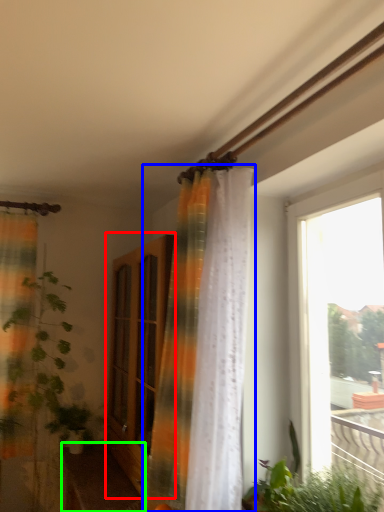
Question: Estimate the real-world distances between objects in this image. Which object is closer to screen door (highlighted by a red box), curtain (highlighted by a blue box) or furniture (highlighted by a green box)?

Choices:
 (A) curtain
 (B) furniture

Answer: (A)